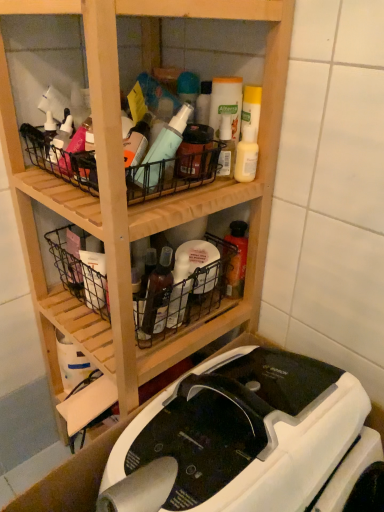
Question: From the image's perspective, is black wire basket at upper center, marked as the 1th basket in a top-to-bottom arrangement, on wooden shelf at center?

Choices:
 (A) no
 (B) yes

Answer: (B)

Question: Is black wire basket at upper center, the second basket from the bottom, aimed at wooden shelf at center?

Choices:
 (A) no
 (B) yes

Answer: (B)

Question: Considering the relative sizes of black wire basket at upper center, marked as the 1th basket in a top-to-bottom arrangement, and wooden shelf at center in the image provided, is black wire basket at upper center, marked as the 1th basket in a top-to-bottom arrangement, taller than wooden shelf at center?

Choices:
 (A) no
 (B) yes

Answer: (A)

Question: Can you confirm if black wire basket at upper center, marked as the 1th basket in a top-to-bottom arrangement, is thinner than wooden shelf at center?

Choices:
 (A) yes
 (B) no

Answer: (A)

Question: Does black wire basket at upper center, marked as the 1th basket in a top-to-bottom arrangement, have a greater width compared to wooden shelf at center?

Choices:
 (A) yes
 (B) no

Answer: (B)

Question: Considering the positions of point (56, 163) and point (102, 362), is point (56, 163) closer or farther from the camera than point (102, 362)?

Choices:
 (A) farther
 (B) closer

Answer: (B)

Question: In terms of height, does black wire basket at upper center, marked as the 1th basket in a top-to-bottom arrangement, look taller or shorter compared to wooden shelf at center?

Choices:
 (A) tall
 (B) short

Answer: (B)

Question: Is black wire basket at upper center, the second basket from the bottom, inside the boundaries of wooden shelf at center, or outside?

Choices:
 (A) inside
 (B) outside

Answer: (A)

Question: Considering the relative positions of black wire basket at upper center, marked as the 1th basket in a top-to-bottom arrangement, and wooden shelf at center in the image provided, is black wire basket at upper center, marked as the 1th basket in a top-to-bottom arrangement, to the left or to the right of wooden shelf at center?

Choices:
 (A) left
 (B) right

Answer: (A)

Question: In the image, is wooden shelf at center positioned in front of or behind black wire basket at center, which is the second basket in top-to-bottom order?

Choices:
 (A) behind
 (B) front

Answer: (B)

Question: From the image's perspective, is wooden shelf at center positioned above or below black wire basket at center, the 1th basket positioned from the bottom?

Choices:
 (A) below
 (B) above

Answer: (A)

Question: Considering the positions of wooden shelf at center and black wire basket at center, which is the second basket in top-to-bottom order, in the image, is wooden shelf at center taller or shorter than black wire basket at center, which is the second basket in top-to-bottom order,?

Choices:
 (A) tall
 (B) short

Answer: (A)

Question: Would you say wooden shelf at center is to the left or to the right of black wire basket at center, which is the second basket in top-to-bottom order, in the picture?

Choices:
 (A) right
 (B) left

Answer: (A)

Question: Looking at their shapes, would you say white plastic sewing machine at lower center is wider or thinner than black wire basket at center, which is the second basket in top-to-bottom order?

Choices:
 (A) thin
 (B) wide

Answer: (B)

Question: Is point (253, 356) closer or farther from the camera than point (153, 303)?

Choices:
 (A) closer
 (B) farther

Answer: (B)